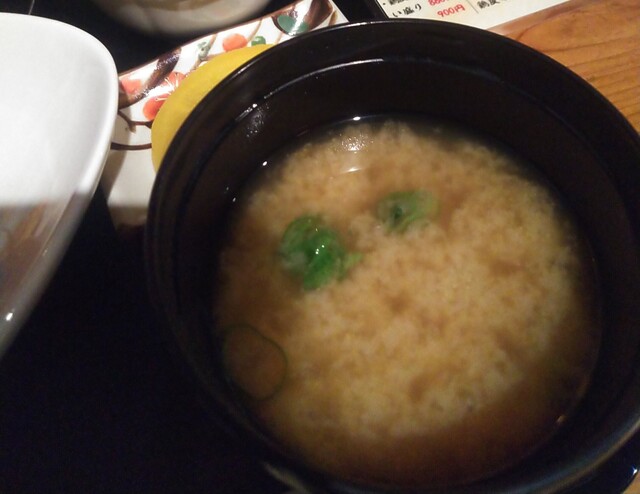
Locate an element on the screen. interior of white dish is located at coordinates (13, 153).